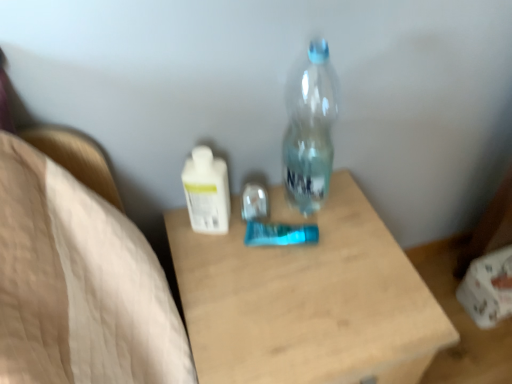
Locate an element on the screen. vacant space to the right of transparent plastic bottle at center, which appears as the first bottle when viewed from the right is located at coordinates (348, 203).